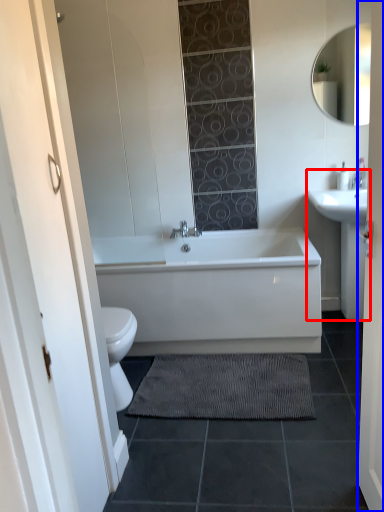
Question: Which object appears closest to the camera in this image, sink (highlighted by a red box) or door (highlighted by a blue box)?

Choices:
 (A) sink
 (B) door

Answer: (B)